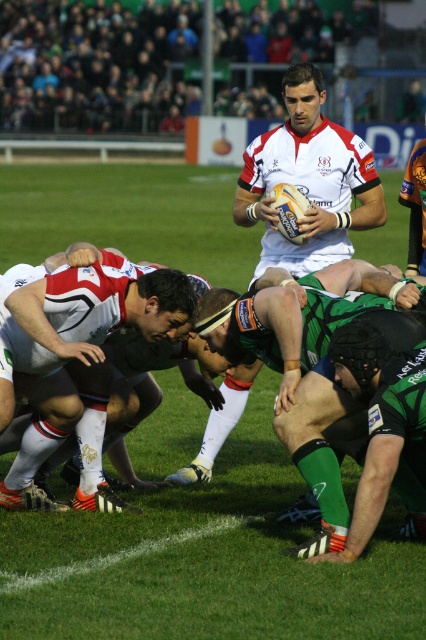
Is green fabric jersey at center thinner than green jersey at lower right?

No.

Who is more distant from viewer, (304,355) or (360,512)?

Positioned behind is point (304,355).

Locate an element on the screen. green fabric jersey at center is located at coordinates (299, 358).

Find the location of a particular element. The width and height of the screenshot is (426, 640). black matte jersey at center is located at coordinates (75, 362).

Who is more forward, (37,362) or (394,392)?

Point (394,392) is in front.

Between point (48, 346) and point (394, 422), which one is positioned in front?

Point (394, 422) is more forward.

At what (x,y) coordinates should I click in order to perform the action: click on black matte jersey at center. Please return your answer as a coordinate pair (x, y). This screenshot has width=426, height=640. Looking at the image, I should click on (75, 362).

Who is positioned more to the left, black matte jersey at center or white matte rugby ball at center?

black matte jersey at center is more to the left.

Locate an element on the screen. Image resolution: width=426 pixels, height=640 pixels. black matte jersey at center is located at coordinates (75, 362).

Image resolution: width=426 pixels, height=640 pixels. I want to click on black matte jersey at center, so click(75, 362).